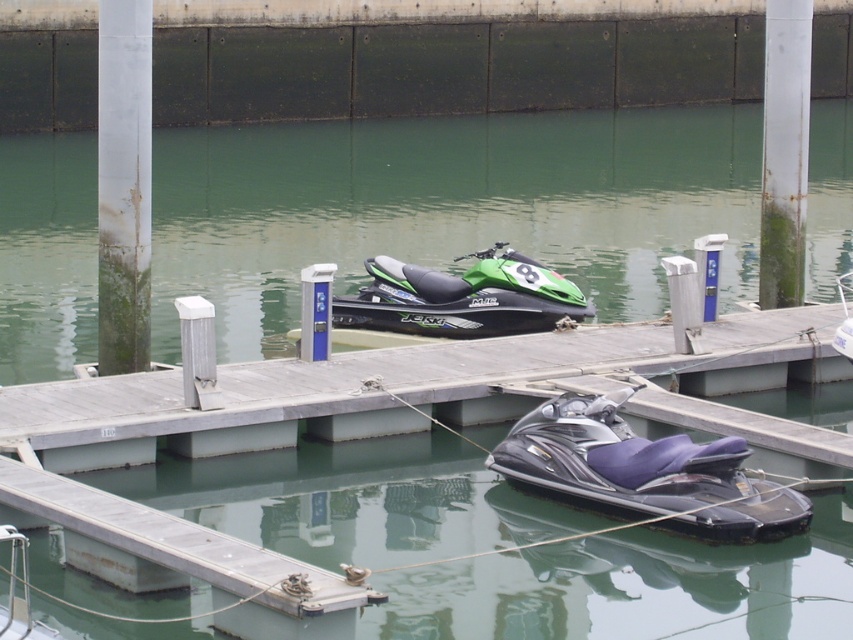
What do you see at coordinates (438, 392) in the screenshot?
I see `smooth gray dock at center` at bounding box center [438, 392].

Describe the element at coordinates (438, 392) in the screenshot. I see `smooth gray dock at center` at that location.

The height and width of the screenshot is (640, 853). Identify the location of smooth gray dock at center. (438, 392).

Measure the distance between point (502, 445) and camera.

Point (502, 445) is 48.65 feet from camera.

Looking at this image, who is shorter, shiny black jet ski at lower center or green matte jet ski at center?

green matte jet ski at center is shorter.

Is point (718, 516) closer to camera compared to point (456, 282)?

Yes.

Where is `shiny black jet ski at lower center`? The width and height of the screenshot is (853, 640). shiny black jet ski at lower center is located at coordinates (643, 472).

Image resolution: width=853 pixels, height=640 pixels. Describe the element at coordinates (438, 392) in the screenshot. I see `smooth gray dock at center` at that location.

Can you confirm if smooth gray dock at center is positioned to the left of green matte jet ski at center?

Indeed, smooth gray dock at center is positioned on the left side of green matte jet ski at center.

The image size is (853, 640). What are the coordinates of `smooth gray dock at center` in the screenshot? It's located at (438, 392).